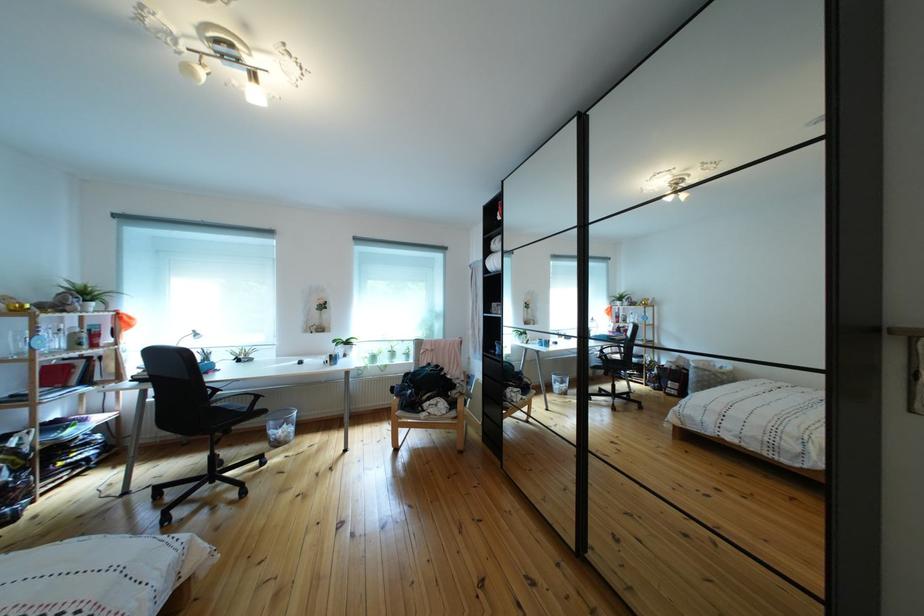
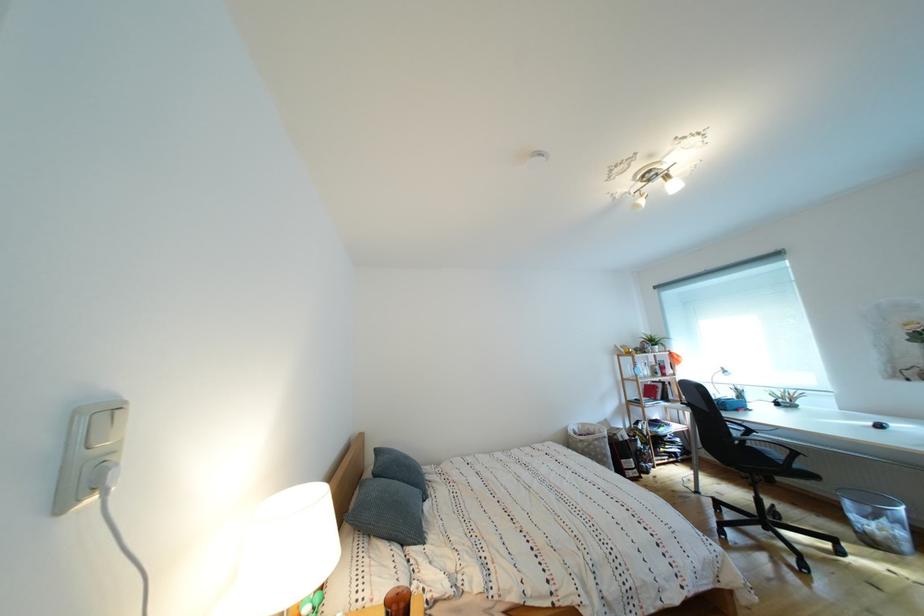
Locate, in the second image, the point that corresponds to (64,358) in the first image.

(657, 383)